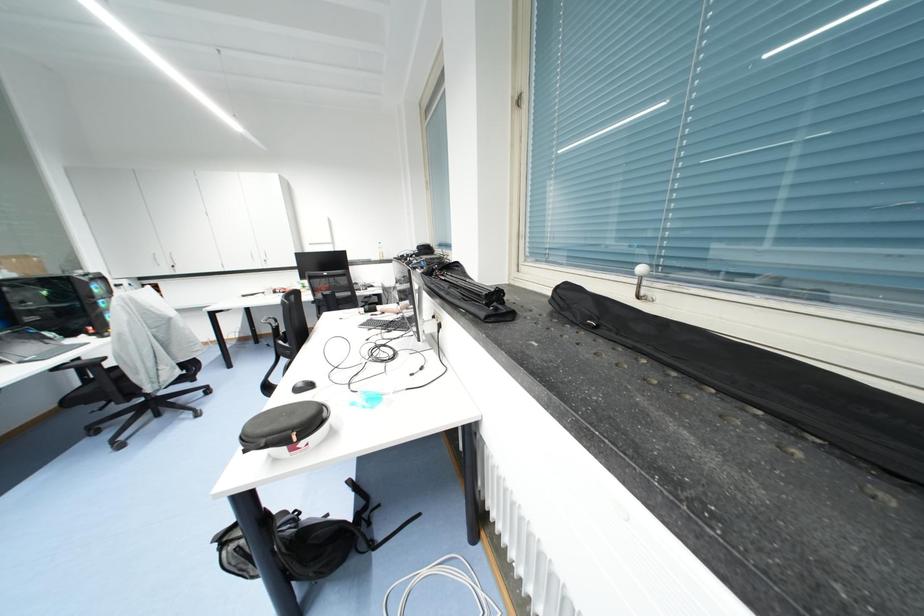
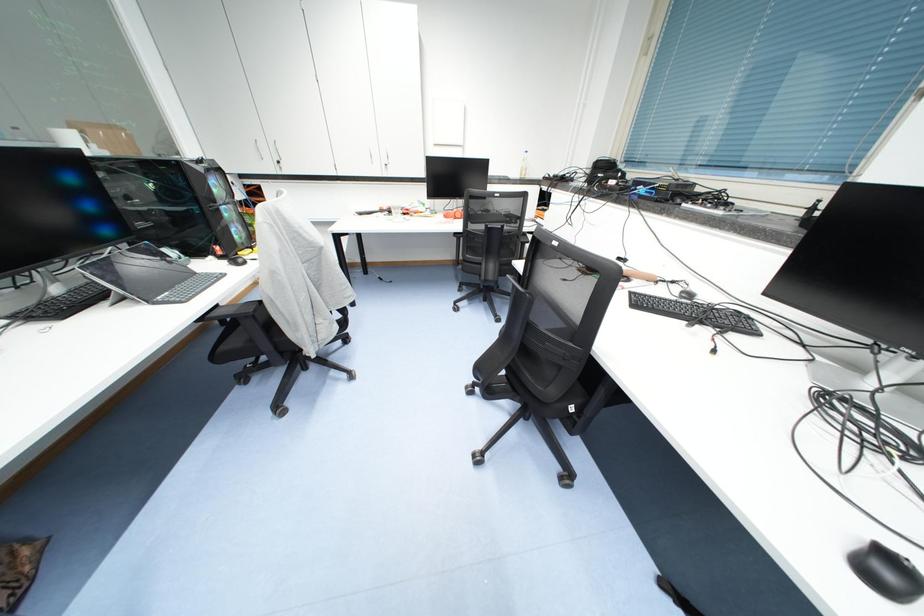
What movement of the cameraman would produce the second image?

The cameraman walked toward left, forward.